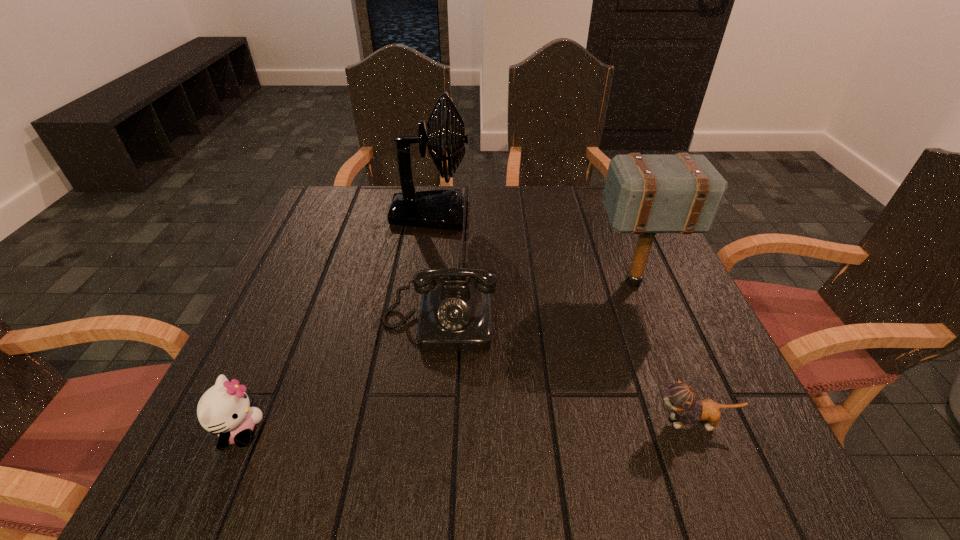
The height and width of the screenshot is (540, 960). Identify the location of vacant space located 0.060m on the front-facing side of the left kitten. (298, 431).

Locate an element on the screen. The height and width of the screenshot is (540, 960). free spot located on the front-facing side of the right kitten is located at coordinates (455, 422).

Image resolution: width=960 pixels, height=540 pixels. What are the coordinates of `free location located on the front-facing side of the right kitten` in the screenshot? It's located at pyautogui.click(x=597, y=422).

Locate an element on the screen. The image size is (960, 540). vacant region located 0.250m on the front-facing side of the right kitten is located at coordinates (502, 422).

At what (x,y) coordinates should I click in order to perform the action: click on object at the far edge. Please return your answer as a coordinate pair (x, y). Image resolution: width=960 pixels, height=540 pixels. Looking at the image, I should click on (443, 209).

This screenshot has width=960, height=540. In order to click on object present at the left edge in this screenshot , I will do `click(224, 409)`.

The width and height of the screenshot is (960, 540). I want to click on mallet positioned at the right edge, so click(x=644, y=194).

Locate an element on the screen. The width and height of the screenshot is (960, 540). kitten at the right edge is located at coordinates (681, 397).

Locate an element on the screen. The image size is (960, 540). object that is positioned at the near left corner is located at coordinates (224, 409).

This screenshot has height=540, width=960. I want to click on object that is at the near right corner, so tap(681, 397).